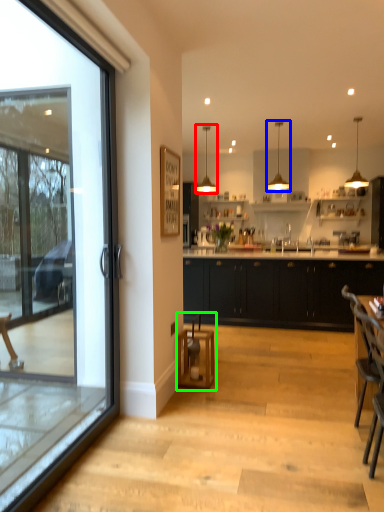
Question: Which object is positioned closest to lamp (highlighted by a red box)? Select from lamp (highlighted by a blue box) and bar stool (highlighted by a green box).

Choices:
 (A) lamp
 (B) bar stool

Answer: (A)